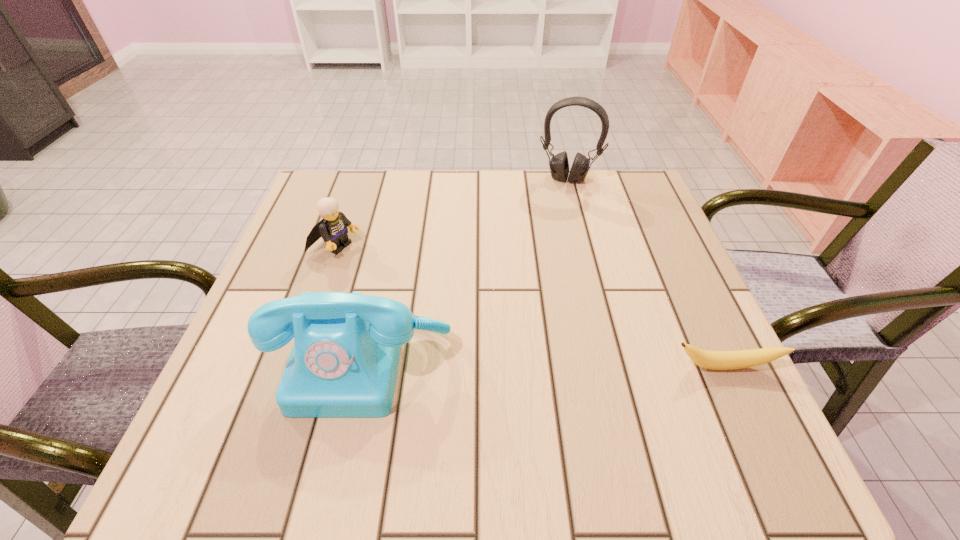
You are a GUI agent. You are given a task and a screenshot of the screen. Output one action in this format:
    pyautogui.click(x=<x>, y=<y>)
    Task: Click on the unoccupied area between the Lego and the banana
    Image resolution: width=960 pixels, height=540 pixels.
    Given the screenshot: What is the action you would take?
    pyautogui.click(x=531, y=305)

Where is `empty space between the second tallest object and the banana`? empty space between the second tallest object and the banana is located at coordinates [x=544, y=364].

At what (x,y) coordinates should I click in order to perform the action: click on vacant area that lies between the telephone and the rightmost object. Please return your answer as a coordinate pair (x, y). The image size is (960, 540). Looking at the image, I should click on (544, 364).

Find the location of a particular element. free area in between the telephone and the headset is located at coordinates (466, 270).

Where is `free space between the banana and the Lego`? The width and height of the screenshot is (960, 540). free space between the banana and the Lego is located at coordinates (531, 305).

Where is `empty space that is in between the headset and the telephone`? Image resolution: width=960 pixels, height=540 pixels. empty space that is in between the headset and the telephone is located at coordinates (466, 270).

Locate an element on the screen. The width and height of the screenshot is (960, 540). free spot between the second shortest object and the headset is located at coordinates (452, 211).

At what (x,y) coordinates should I click in order to perform the action: click on free space between the Lego and the headset. Please return your answer as a coordinate pair (x, y). This screenshot has height=540, width=960. Looking at the image, I should click on (452, 211).

Identify the location of object that is the closest one to the second farthest object. This screenshot has height=540, width=960. (344, 361).

Where is `object that is the second closest to the banana`? This screenshot has height=540, width=960. object that is the second closest to the banana is located at coordinates (559, 166).